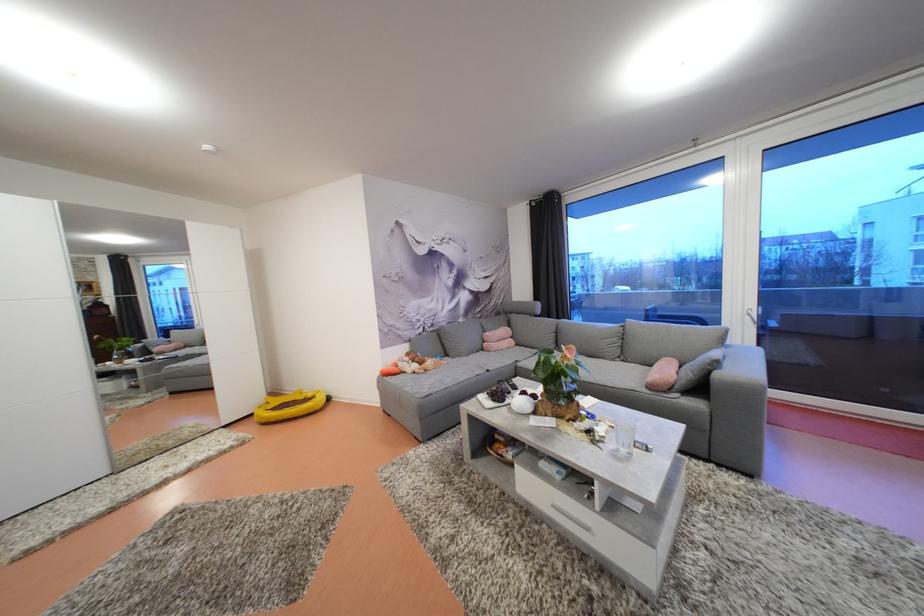
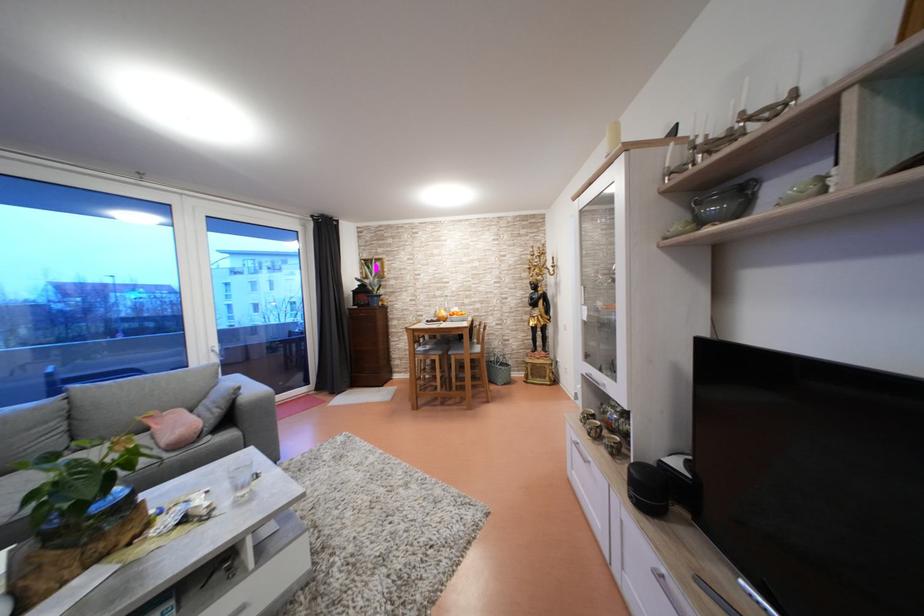
The point at (707, 392) is marked in the first image. Where is the corresponding point in the second image?

(237, 424)